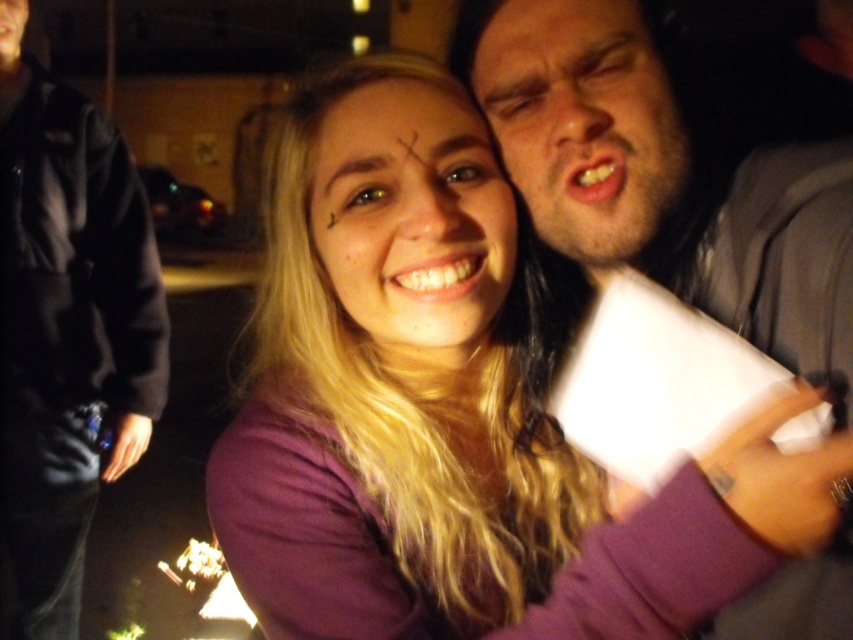
Question: Which object is the closest to the purple matte shirt at center?

Choices:
 (A) bearded man at right
 (B) matte skin face at center

Answer: (B)

Question: Which object appears closest to the camera in this image?

Choices:
 (A) purple matte shirt at center
 (B) matte skin face at center
 (C) black fleece jacket at center

Answer: (A)

Question: Does black fleece jacket at center appear over matte skin face at center?

Choices:
 (A) no
 (B) yes

Answer: (A)

Question: Does purple matte shirt at center have a larger size compared to matte skin face at center?

Choices:
 (A) no
 (B) yes

Answer: (B)

Question: Which of the following is the farthest from the observer?

Choices:
 (A) (61, 90)
 (B) (502, 262)
 (C) (474, 602)

Answer: (A)

Question: Is purple matte shirt at center wider than bearded man at right?

Choices:
 (A) no
 (B) yes

Answer: (B)